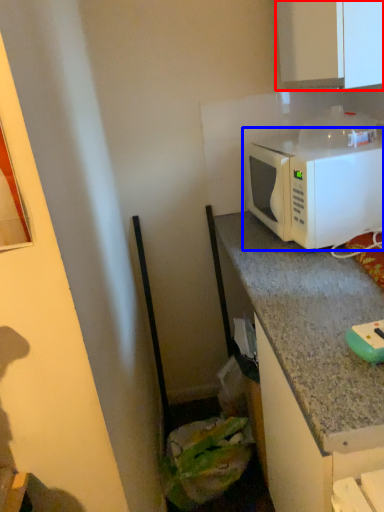
Question: Which object appears farthest to the camera in this image, cabinetry (highlighted by a red box) or microwave oven (highlighted by a blue box)?

Choices:
 (A) cabinetry
 (B) microwave oven

Answer: (B)